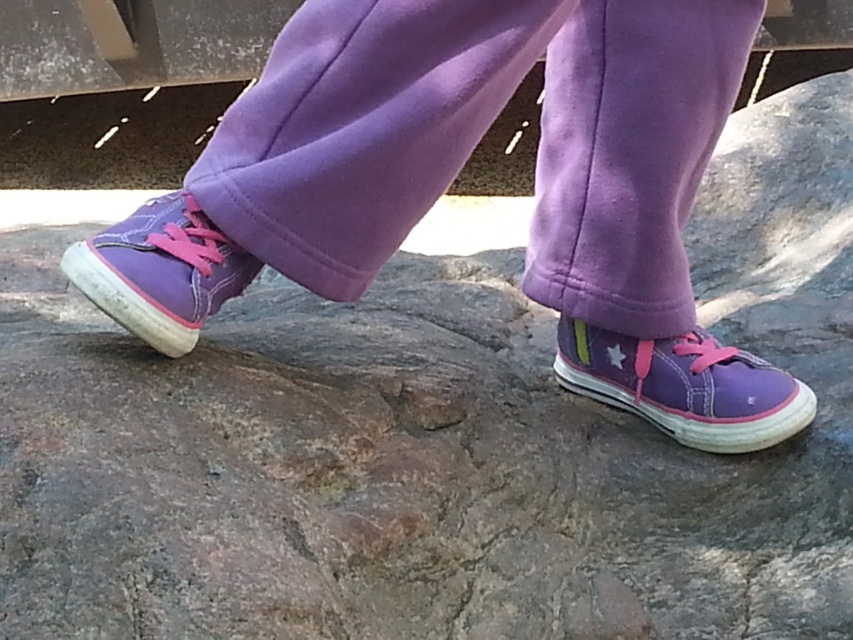
You are trying to decide which shoe to wear for a hike. You see the purple canvas shoe at center and the matte purple sneaker at center in the image. Which one has a lower height?

The purple canvas shoe at center is not as tall as the matte purple sneaker at center, so the purple canvas shoe at center has a lower height.

You are a photographer trying to capture the purple fleece pants at center in the image. Where exactly should you focus your camera to ensure the pants are in sharp focus?

You should focus your camera at point [479,138] where the purple fleece pants at center are located.

You are a fitness trainer designing an obstacle course. You need to place a small obstacle between the purple fleece pants at center and the matte purple sneaker at center. What is the minimum width the obstacle should be to fit between them?

The distance between the purple fleece pants at center and the matte purple sneaker at center is 9.95 inches, so the obstacle should be at least 9.95 inches wide to fit between them.